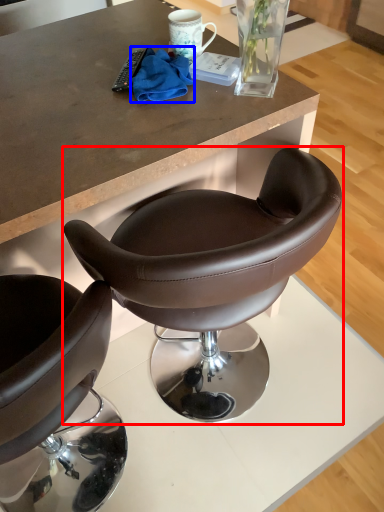
Question: Which object appears closest to the camera in this image, chair (highlighted by a red box) or material (highlighted by a blue box)?

Choices:
 (A) chair
 (B) material

Answer: (A)